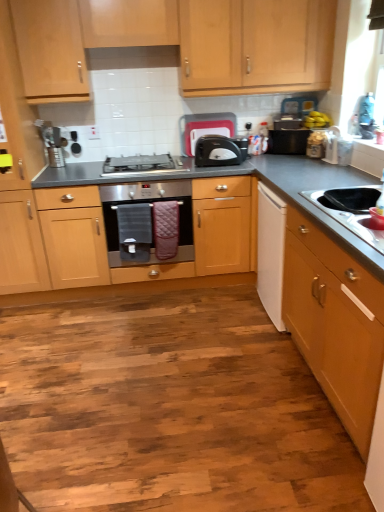
Question: Considering the relative sizes of white matte drawer at right and light wood cabinet at right, the first cabinetry when ordered from front to back, in the image provided, is white matte drawer at right taller than light wood cabinet at right, the first cabinetry when ordered from front to back,?

Choices:
 (A) yes
 (B) no

Answer: (A)

Question: Is white matte drawer at right aimed at light wood cabinet at right, which is the 2th cabinetry from top to bottom?

Choices:
 (A) yes
 (B) no

Answer: (B)

Question: Is white matte drawer at right far away from light wood cabinet at right, positioned as the 1th cabinetry in bottom-to-top order?

Choices:
 (A) no
 (B) yes

Answer: (A)

Question: Is the position of white matte drawer at right more distant than that of light wood cabinet at right, the first cabinetry when ordered from front to back?

Choices:
 (A) yes
 (B) no

Answer: (A)

Question: Can you confirm if white matte drawer at right is bigger than light wood cabinet at right, positioned as the 1th cabinetry in bottom-to-top order?

Choices:
 (A) no
 (B) yes

Answer: (A)

Question: Considering the relative sizes of white matte drawer at right and light wood cabinet at right, the first cabinetry when ordered from front to back, in the image provided, is white matte drawer at right thinner than light wood cabinet at right, the first cabinetry when ordered from front to back,?

Choices:
 (A) no
 (B) yes

Answer: (B)

Question: Is light wood cabinet at right, the first cabinetry when ordered from front to back, to the left of black plastic toaster at center, positioned as the 2th appliance in right-to-left order, from the viewer's perspective?

Choices:
 (A) yes
 (B) no

Answer: (B)

Question: Is the depth of light wood cabinet at right, which ranks as the second cabinetry in back-to-front order, less than that of black plastic toaster at center, positioned as the 3th appliance in left-to-right order?

Choices:
 (A) yes
 (B) no

Answer: (A)

Question: From the image's perspective, is light wood cabinet at right, which ranks as the second cabinetry in back-to-front order, over black plastic toaster at center, positioned as the 2th appliance in right-to-left order?

Choices:
 (A) yes
 (B) no

Answer: (B)

Question: Can you confirm if light wood cabinet at right, positioned as the 1th cabinetry in bottom-to-top order, is bigger than black plastic toaster at center, positioned as the 2th appliance in right-to-left order?

Choices:
 (A) yes
 (B) no

Answer: (A)

Question: Considering the relative sizes of light wood cabinet at right, which is the 2th cabinetry from top to bottom, and black plastic toaster at center, positioned as the 2th appliance in right-to-left order, in the image provided, is light wood cabinet at right, which is the 2th cabinetry from top to bottom, smaller than black plastic toaster at center, positioned as the 2th appliance in right-to-left order,?

Choices:
 (A) no
 (B) yes

Answer: (A)

Question: Could you tell me if light wood cabinet at right, positioned as the 1th cabinetry in bottom-to-top order, is facing black plastic toaster at center, positioned as the 3th appliance in left-to-right order?

Choices:
 (A) yes
 (B) no

Answer: (B)

Question: Is satin silver gas stove at center with stainless steel oven at center?

Choices:
 (A) no
 (B) yes

Answer: (A)